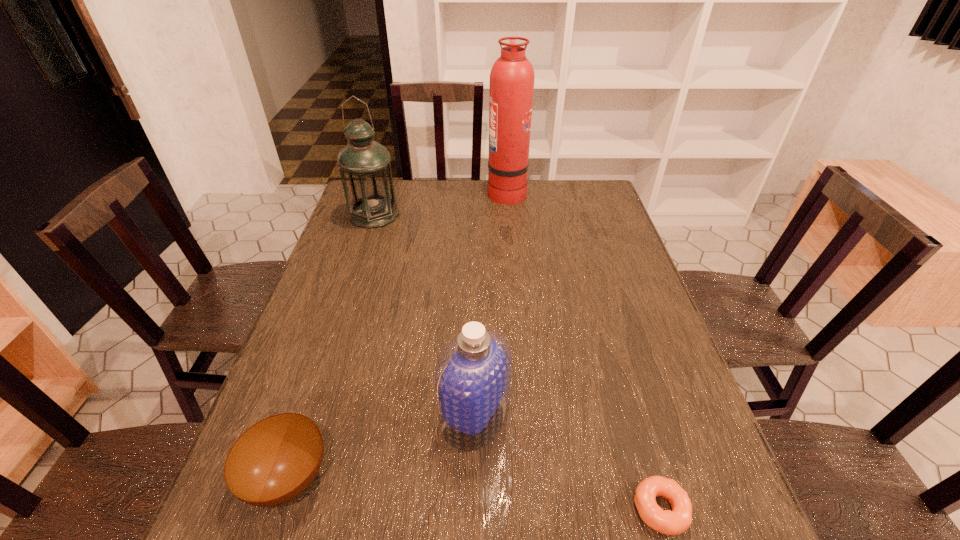
Where is `vacant space located 0.240m on the left of the cleansing agent`? The image size is (960, 540). vacant space located 0.240m on the left of the cleansing agent is located at coordinates (327, 415).

Image resolution: width=960 pixels, height=540 pixels. What are the coordinates of `vacant area situated 0.390m on the back of the bowl` in the screenshot? It's located at (346, 304).

Find the location of `vacant space located on the back of the doughnut`. vacant space located on the back of the doughnut is located at coordinates (639, 437).

This screenshot has height=540, width=960. Identify the location of fire extinguisher that is at the far edge. (512, 76).

Locate an element on the screen. This screenshot has height=540, width=960. oil lamp present at the far edge is located at coordinates (364, 165).

The width and height of the screenshot is (960, 540). Find the location of `object positioned at the near edge`. object positioned at the near edge is located at coordinates (677, 521).

Where is `oil lamp at the left edge`? oil lamp at the left edge is located at coordinates (364, 165).

This screenshot has height=540, width=960. In order to click on bowl located in the left edge section of the desktop in this screenshot , I will do `click(275, 460)`.

Identify the location of object that is at the right edge. (677, 521).

Locate an element on the screen. This screenshot has width=960, height=540. object that is at the far left corner is located at coordinates (364, 165).